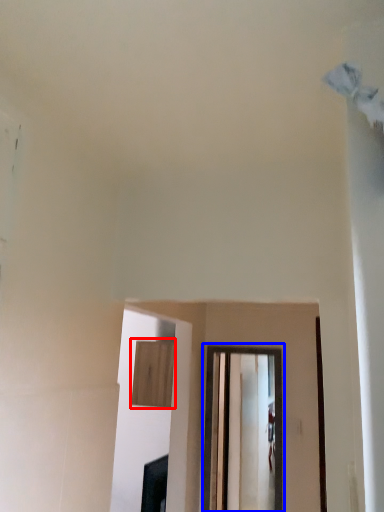
Question: Which object is closer to the camera taking this photo, cabinetry (highlighted by a red box) or window (highlighted by a blue box)?

Choices:
 (A) cabinetry
 (B) window

Answer: (B)